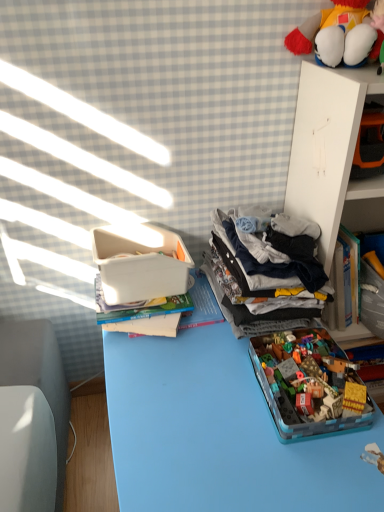
Question: Is the depth of white plastic container at upper left greater than that of translucent plastic container at center, which is the second toy in top-to-bottom order?

Choices:
 (A) no
 (B) yes

Answer: (B)

Question: Would you say white plastic container at upper left contains translucent plastic container at center, the first toy ordered from the bottom?

Choices:
 (A) no
 (B) yes

Answer: (A)

Question: Can you confirm if white plastic container at upper left is shorter than translucent plastic container at center, which is the second toy in top-to-bottom order?

Choices:
 (A) no
 (B) yes

Answer: (A)

Question: Is white plastic container at upper left bigger than translucent plastic container at center, the first toy ordered from the bottom?

Choices:
 (A) yes
 (B) no

Answer: (A)

Question: From a real-world perspective, is white plastic container at upper left located beneath translucent plastic container at center, which is the second toy in top-to-bottom order?

Choices:
 (A) no
 (B) yes

Answer: (A)

Question: Is white plastic container at upper left to the left of translucent plastic container at center, which is the second toy in top-to-bottom order, from the viewer's perspective?

Choices:
 (A) yes
 (B) no

Answer: (A)

Question: Can you confirm if fluffy plush toy at upper right, the 1th toy in the top-to-bottom sequence, is bigger than white plastic container at upper left?

Choices:
 (A) yes
 (B) no

Answer: (B)

Question: Is the depth of fluffy plush toy at upper right, which ranks as the second toy in bottom-to-top order, greater than that of white plastic container at upper left?

Choices:
 (A) yes
 (B) no

Answer: (A)

Question: From a real-world perspective, is fluffy plush toy at upper right, which ranks as the second toy in bottom-to-top order, beneath white plastic container at upper left?

Choices:
 (A) yes
 (B) no

Answer: (B)

Question: Is fluffy plush toy at upper right, which ranks as the second toy in bottom-to-top order, wider than white plastic container at upper left?

Choices:
 (A) no
 (B) yes

Answer: (A)

Question: Is fluffy plush toy at upper right, which ranks as the second toy in bottom-to-top order, at the right side of white plastic container at upper left?

Choices:
 (A) yes
 (B) no

Answer: (A)

Question: From a real-world perspective, is fluffy plush toy at upper right, which ranks as the second toy in bottom-to-top order, on top of white plastic container at upper left?

Choices:
 (A) no
 (B) yes

Answer: (B)

Question: From the image's perspective, is white plastic container at upper left beneath dark gray cotton clothes at center right?

Choices:
 (A) no
 (B) yes

Answer: (B)